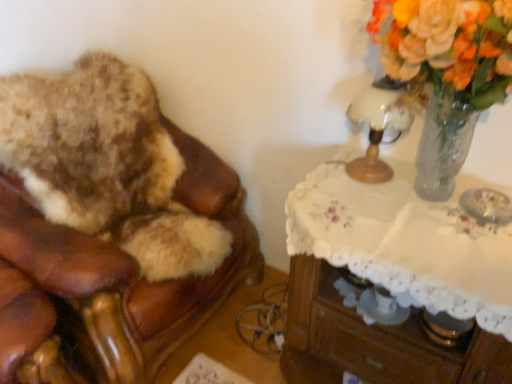
What are the coordinates of `vacant area that is in front of white glass table lamp at upper right` in the screenshot? It's located at (379, 211).